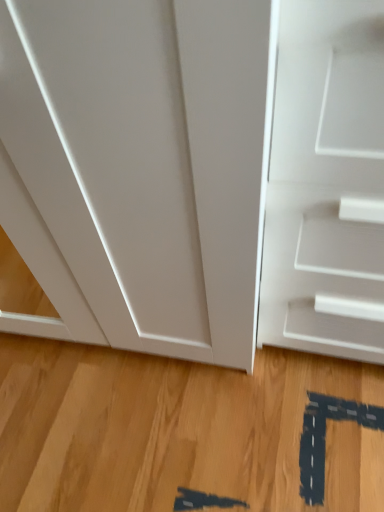
This screenshot has width=384, height=512. I want to click on free space to the left of white matte door at right, so click(236, 396).